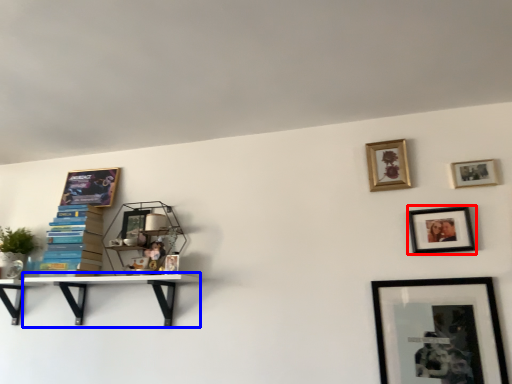
Question: Among these objects, which one is nearest to the camera, picture frame (highlighted by a red box) or shelf (highlighted by a blue box)?

Choices:
 (A) picture frame
 (B) shelf

Answer: (A)